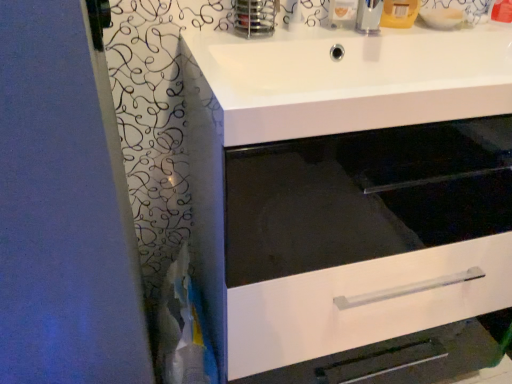
Question: From a real-world perspective, is white glossy drawer at center positioned above or below white glossy sink at upper center?

Choices:
 (A) below
 (B) above

Answer: (A)

Question: Considering their positions, is white glossy drawer at center located in front of or behind white glossy sink at upper center?

Choices:
 (A) behind
 (B) front

Answer: (A)

Question: Is point coord(246,352) positioned closer to the camera than point coord(487,114)?

Choices:
 (A) farther
 (B) closer

Answer: (A)

Question: Considering their positions, is white glossy sink at upper center located in front of or behind white glossy drawer at center?

Choices:
 (A) front
 (B) behind

Answer: (A)

Question: Considering the relative positions of white glossy sink at upper center and white glossy drawer at center in the image provided, is white glossy sink at upper center to the left or to the right of white glossy drawer at center?

Choices:
 (A) left
 (B) right

Answer: (B)

Question: Is white glossy sink at upper center spatially inside white glossy drawer at center, or outside of it?

Choices:
 (A) outside
 (B) inside

Answer: (B)

Question: In terms of size, does white glossy sink at upper center appear bigger or smaller than white glossy drawer at center?

Choices:
 (A) small
 (B) big

Answer: (A)